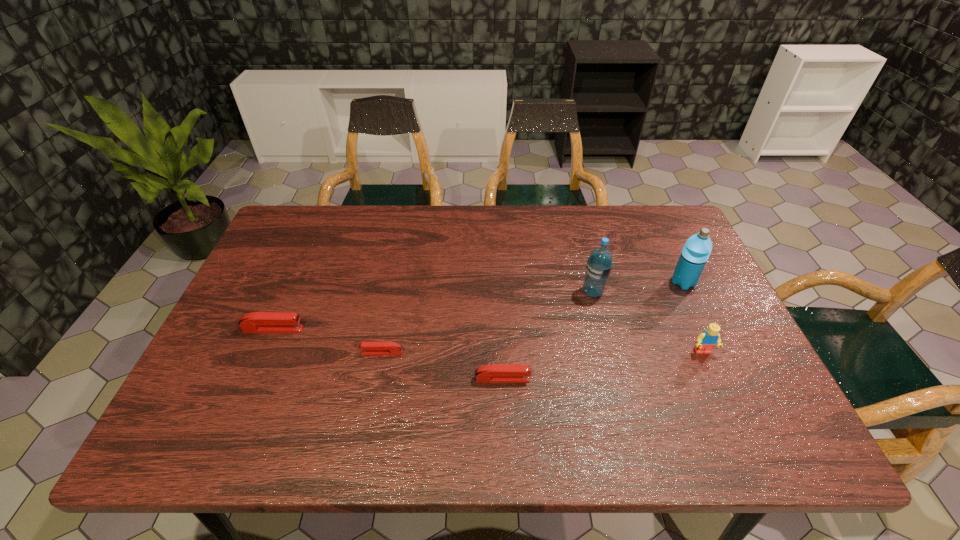
You are a GUI agent. You are given a task and a screenshot of the screen. Output one action in this format:
    pyautogui.click(x=<x>, y=<y>)
    Task: Click on the stapler that is the third closest to the Lego
    The width and height of the screenshot is (960, 540).
    Given the screenshot: What is the action you would take?
    pyautogui.click(x=256, y=322)

Find the location of `free space that satisfies the following two spatial constraints: 1. on the front-facing side of the third tallest object; 2. on the front-facing side of the shortest object`. free space that satisfies the following two spatial constraints: 1. on the front-facing side of the third tallest object; 2. on the front-facing side of the shortest object is located at coordinates (703, 353).

I want to click on vacant point that satisfies the following two spatial constraints: 1. on the front side of the thermos bottle; 2. on the front-facing side of the rightmost stapler, so click(729, 379).

At what (x,y) coordinates should I click in order to perform the action: click on free point that satisfies the following two spatial constraints: 1. on the front-facing side of the Lego; 2. on the front-facing side of the second stapler from left to right. Please return your answer as a coordinate pair (x, y). This screenshot has width=960, height=540. Looking at the image, I should click on (703, 353).

Where is `vacant space that satisfies the following two spatial constraints: 1. on the front side of the fourth object from left to right; 2. on the front-facing side of the rightmost stapler`? This screenshot has width=960, height=540. vacant space that satisfies the following two spatial constraints: 1. on the front side of the fourth object from left to right; 2. on the front-facing side of the rightmost stapler is located at coordinates (614, 379).